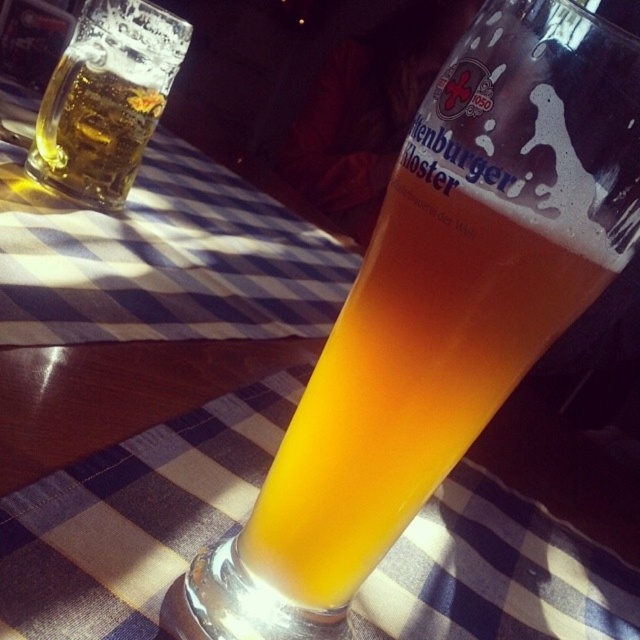
Which is below, translucent glass beer at center or translucent glass mug at upper left?

translucent glass beer at center

Is point (374, 481) farther from camera compared to point (122, 80)?

No.

At what (x,y) coordinates should I click in order to perform the action: click on translucent glass beer at center. Please return your answer as a coordinate pair (x, y). The image size is (640, 640). Looking at the image, I should click on (438, 312).

At what (x,y) coordinates should I click in order to perform the action: click on translucent glass beer at center. Please return your answer as a coordinate pair (x, y). Looking at the image, I should click on (438, 312).